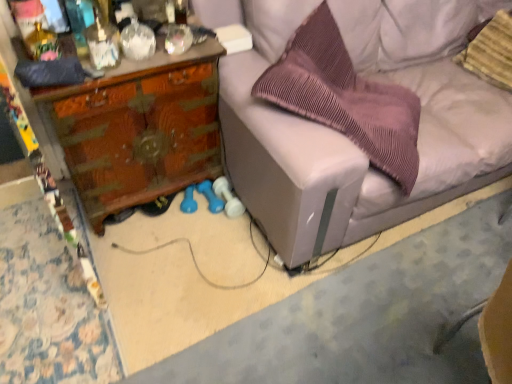
Question: Does purple pleated pillow at center, which is the 2th pillow in right-to-left order, appear on the right side of striped fabric pillow at upper right, the 1th pillow when ordered from right to left?

Choices:
 (A) yes
 (B) no

Answer: (B)

Question: From the image's perspective, is purple pleated pillow at center, placed as the first pillow when sorted from left to right, on striped fabric pillow at upper right, the 1th pillow when ordered from right to left?

Choices:
 (A) no
 (B) yes

Answer: (A)

Question: Does purple pleated pillow at center, which is the 2th pillow in right-to-left order, lie behind striped fabric pillow at upper right, the 1th pillow when ordered from right to left?

Choices:
 (A) no
 (B) yes

Answer: (A)

Question: Is the surface of purple pleated pillow at center, placed as the first pillow when sorted from left to right, in direct contact with striped fabric pillow at upper right, the 1th pillow when ordered from right to left?

Choices:
 (A) no
 (B) yes

Answer: (A)

Question: Does purple pleated pillow at center, which is the 2th pillow in right-to-left order, have a smaller size compared to striped fabric pillow at upper right, acting as the second pillow starting from the left?

Choices:
 (A) no
 (B) yes

Answer: (A)

Question: Is wooden desk at left taller or shorter than striped fabric pillow at upper right, the 1th pillow when ordered from right to left?

Choices:
 (A) short
 (B) tall

Answer: (B)

Question: Is wooden desk at left in front of or behind striped fabric pillow at upper right, acting as the second pillow starting from the left, in the image?

Choices:
 (A) behind
 (B) front

Answer: (B)

Question: In terms of size, does wooden desk at left appear bigger or smaller than striped fabric pillow at upper right, the 1th pillow when ordered from right to left?

Choices:
 (A) big
 (B) small

Answer: (A)

Question: Does point (134, 119) appear closer or farther from the camera than point (483, 36)?

Choices:
 (A) farther
 (B) closer

Answer: (B)

Question: Is wooden desk at left situated inside purple pleated pillow at center, placed as the first pillow when sorted from left to right, or outside?

Choices:
 (A) inside
 (B) outside

Answer: (B)

Question: Would you say wooden desk at left is to the left or to the right of purple pleated pillow at center, placed as the first pillow when sorted from left to right, in the picture?

Choices:
 (A) left
 (B) right

Answer: (A)

Question: Is point (50, 119) positioned closer to the camera than point (415, 117)?

Choices:
 (A) closer
 (B) farther

Answer: (A)

Question: From the image's perspective, is wooden desk at left above or below purple pleated pillow at center, which is the 2th pillow in right-to-left order?

Choices:
 (A) above
 (B) below

Answer: (B)

Question: Does point (98, 190) appear closer or farther from the camera than point (454, 21)?

Choices:
 (A) closer
 (B) farther

Answer: (A)

Question: Considering the positions of wooden desk at left and light gray fabric couch at center in the image, is wooden desk at left wider or thinner than light gray fabric couch at center?

Choices:
 (A) thin
 (B) wide

Answer: (A)